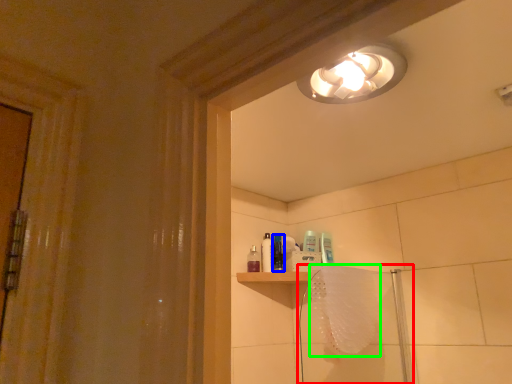
Question: Considering the real-world distances, which object is farthest from shower door (highlighted by a red box)? toiletry (highlighted by a blue box) or bath towel (highlighted by a green box)?

Choices:
 (A) toiletry
 (B) bath towel

Answer: (A)